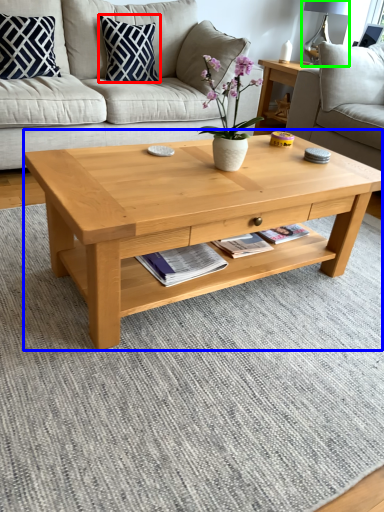
Question: Which is nearer to the pillow (highlighted by a red box)? coffee table (highlighted by a blue box) or lamp (highlighted by a green box).

Choices:
 (A) coffee table
 (B) lamp

Answer: (A)